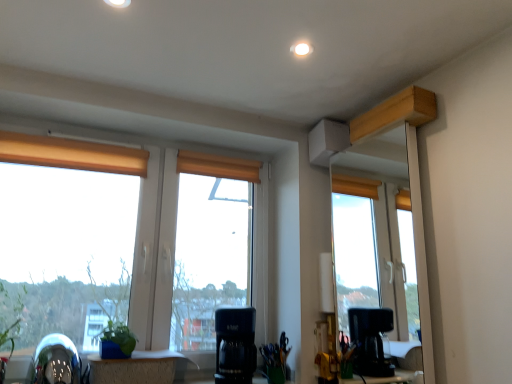
Question: Can you confirm if wooden table at lower center is smaller than shiny metallic swivel chair at lower left?

Choices:
 (A) no
 (B) yes

Answer: (B)

Question: Is wooden table at lower center aimed at shiny metallic swivel chair at lower left?

Choices:
 (A) yes
 (B) no

Answer: (B)

Question: Is wooden table at lower center at the left side of shiny metallic swivel chair at lower left?

Choices:
 (A) yes
 (B) no

Answer: (B)

Question: From the image's perspective, is wooden table at lower center beneath shiny metallic swivel chair at lower left?

Choices:
 (A) no
 (B) yes

Answer: (B)

Question: From the image's perspective, is wooden table at lower center on shiny metallic swivel chair at lower left?

Choices:
 (A) no
 (B) yes

Answer: (A)

Question: From the image's perspective, is green leafy plant at lower left above or below shiny metallic swivel chair at lower left?

Choices:
 (A) above
 (B) below

Answer: (A)

Question: Is green leafy plant at lower left inside or outside of shiny metallic swivel chair at lower left?

Choices:
 (A) inside
 (B) outside

Answer: (B)

Question: Relative to shiny metallic swivel chair at lower left, is green leafy plant at lower left in front or behind?

Choices:
 (A) front
 (B) behind

Answer: (A)

Question: Considering the positions of green leafy plant at lower left and shiny metallic swivel chair at lower left in the image, is green leafy plant at lower left wider or thinner than shiny metallic swivel chair at lower left?

Choices:
 (A) wide
 (B) thin

Answer: (B)

Question: Is wooden table at lower center to the left or to the right of shiny metallic swivel chair at lower left in the image?

Choices:
 (A) left
 (B) right

Answer: (B)

Question: Is wooden table at lower center wider or thinner than shiny metallic swivel chair at lower left?

Choices:
 (A) thin
 (B) wide

Answer: (A)

Question: Considering their positions, is wooden table at lower center located in front of or behind shiny metallic swivel chair at lower left?

Choices:
 (A) behind
 (B) front

Answer: (A)

Question: Considering the positions of wooden table at lower center and shiny metallic swivel chair at lower left in the image, is wooden table at lower center bigger or smaller than shiny metallic swivel chair at lower left?

Choices:
 (A) big
 (B) small

Answer: (B)

Question: From the image's perspective, relative to wooden table at lower center, is black plastic coffee maker at center above or below?

Choices:
 (A) below
 (B) above

Answer: (B)

Question: Looking at the image, does black plastic coffee maker at center seem bigger or smaller compared to wooden table at lower center?

Choices:
 (A) small
 (B) big

Answer: (B)